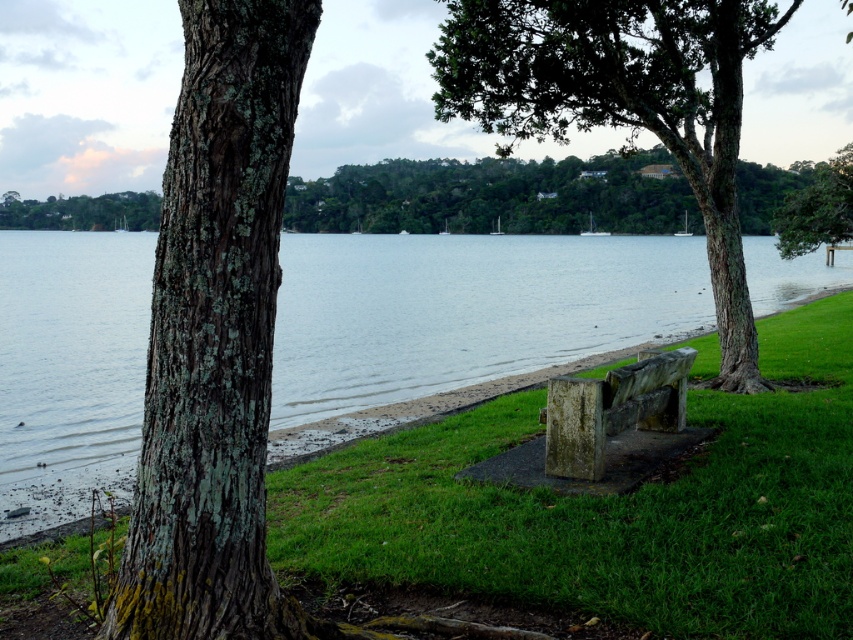
Can you confirm if rusty stone bench at center is wider than green lichen-covered tree at upper center?

Incorrect, rusty stone bench at center's width does not surpass green lichen-covered tree at upper center's.

Does rusty stone bench at center have a smaller size compared to green lichen-covered tree at upper center?

Indeed, rusty stone bench at center has a smaller size compared to green lichen-covered tree at upper center.

Does point (653, 378) come farther from viewer compared to point (7, 205)?

No, (653, 378) is closer to viewer.

Identify the location of rusty stone bench at center. (612, 410).

Is smooth water at center to the right of green rough bark tree at center from the viewer's perspective?

In fact, smooth water at center is to the left of green rough bark tree at center.

Is smooth water at center thinner than green rough bark tree at center?

Incorrect, smooth water at center's width is not less than green rough bark tree at center's.

What do you see at coordinates (465, 310) in the screenshot?
I see `smooth water at center` at bounding box center [465, 310].

The width and height of the screenshot is (853, 640). What are the coordinates of `smooth water at center` in the screenshot? It's located at (465, 310).

Can you confirm if green rough bark tree at center is positioned to the right of green lichen-covered tree at upper center?

Indeed, green rough bark tree at center is positioned on the right side of green lichen-covered tree at upper center.

Can you confirm if green rough bark tree at center is positioned below green lichen-covered tree at upper center?

Yes, green rough bark tree at center is below green lichen-covered tree at upper center.

Locate an element on the screen. green rough bark tree at center is located at coordinates [624, 102].

The image size is (853, 640). Identify the location of green rough bark tree at center. [x=624, y=102].